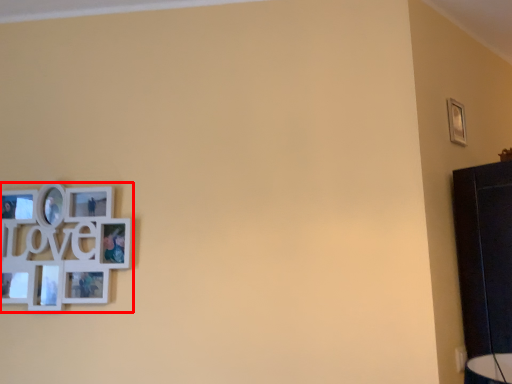
Question: From the image's perspective, where is picture frame (annotated by the red box) located in relation to picture frame in the image?

Choices:
 (A) above
 (B) below

Answer: (B)